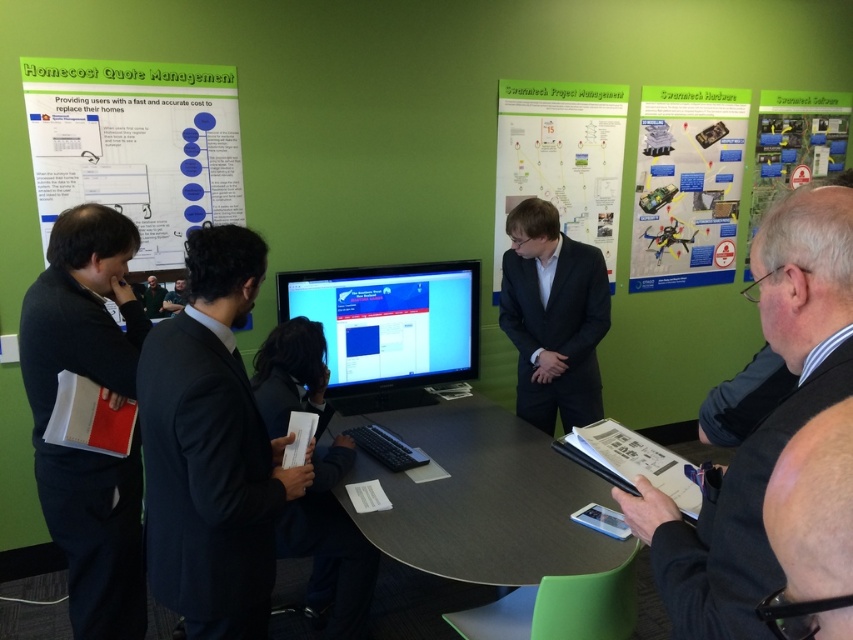
Who is shorter, matte black drone at upper right or dark gray suit at center?

dark gray suit at center is shorter.

Can you confirm if matte black drone at upper right is positioned below dark gray suit at center?

Actually, matte black drone at upper right is above dark gray suit at center.

Which is behind, point (642, 177) or point (546, 253)?

The point (642, 177) is behind.

This screenshot has height=640, width=853. Find the location of `matte black drone at upper right`. matte black drone at upper right is located at coordinates tap(688, 186).

Does white paper at upper left have a larger size compared to green matte poster at upper center?

No, white paper at upper left is not bigger than green matte poster at upper center.

This screenshot has width=853, height=640. What are the coordinates of `white paper at upper left` in the screenshot? It's located at (136, 145).

Does dark gray suit at center have a greater width compared to green fabric shirt at center?

Yes.

Who is positioned more to the left, dark gray suit at center or green fabric shirt at center?

From the viewer's perspective, green fabric shirt at center appears more on the left side.

Between point (532, 388) and point (157, 292), which one is positioned in front?

Positioned in front is point (157, 292).

Where is `dark gray suit at center`? The height and width of the screenshot is (640, 853). dark gray suit at center is located at coordinates (553, 317).